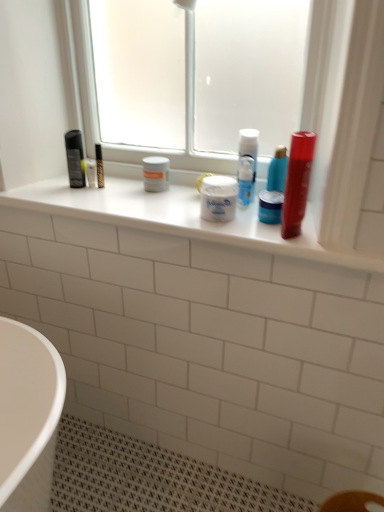
Where is `white matte jar at center`? The width and height of the screenshot is (384, 512). white matte jar at center is located at coordinates (218, 198).

Find the location of a particular element. blue glossy jar at center, which ranks as the second mouthwash in front-to-back order is located at coordinates (270, 206).

What is the approximate width of blue glossy jar at center, the first mouthwash viewed from the back?

3.01 inches.

This screenshot has height=512, width=384. Identify the location of shiny red tube at upper right, arranged as the second mouthwash when viewed from the back. (297, 182).

This screenshot has width=384, height=512. Describe the element at coordinates (297, 182) in the screenshot. I see `shiny red tube at upper right, arranged as the second mouthwash when viewed from the back` at that location.

Image resolution: width=384 pixels, height=512 pixels. What are the coordinates of `white plastic container at center` in the screenshot? It's located at (178, 218).

I want to click on white matte jar at center, so click(218, 198).

Where is `toiletry that appears on the right of white plastic container at center`? Image resolution: width=384 pixels, height=512 pixels. toiletry that appears on the right of white plastic container at center is located at coordinates (218, 198).

What's the angular difference between white matte jar at center and white plastic container at center's facing directions?

0.291 degrees separate the facing orientations of white matte jar at center and white plastic container at center.

From a real-world perspective, is white matte jar at center physically above white plastic container at center?

Correct, in the physical world, white matte jar at center is higher than white plastic container at center.

Is point (221, 180) positioned in front of point (180, 204)?

Yes, point (221, 180) is in front of point (180, 204).

Could white plastic container at center be considered to be inside transparent frosted glass at upper center?

No, white plastic container at center is not a part of transparent frosted glass at upper center.

From a real-world perspective, who is located lower, transparent frosted glass at upper center or white plastic container at center?

From a 3D spatial view, white plastic container at center is below.

Image resolution: width=384 pixels, height=512 pixels. I want to click on window sill lying in front of the transparent frosted glass at upper center, so click(x=178, y=218).

Is transparent frosted glass at upper center facing away from white plastic container at center?

No, white plastic container at center is not at the back of transparent frosted glass at upper center.

From the image's perspective, is blue glossy jar at center, the first mouthwash viewed from the back, located above transparent frosted glass at upper center?

No.

Considering the relative positions of blue glossy jar at center, the first mouthwash viewed from the back, and transparent frosted glass at upper center in the image provided, is blue glossy jar at center, the first mouthwash viewed from the back, to the left or to the right of transparent frosted glass at upper center?

Clearly, blue glossy jar at center, the first mouthwash viewed from the back, is on the right of transparent frosted glass at upper center in the image.

Between blue glossy jar at center, the first mouthwash viewed from the back, and transparent frosted glass at upper center, which one has less height?

Standing shorter between the two is blue glossy jar at center, the first mouthwash viewed from the back.

Is blue glossy jar at center, the first mouthwash viewed from the back, oriented away from transparent frosted glass at upper center?

Yes, blue glossy jar at center, the first mouthwash viewed from the back,'s orientation is away from transparent frosted glass at upper center.

Between blue glossy jar at center, which ranks as the second mouthwash in front-to-back order, and white matte jar at center, which one has larger size?

white matte jar at center.

Which is correct: blue glossy jar at center, the first mouthwash viewed from the back, is inside white matte jar at center, or outside of it?

blue glossy jar at center, the first mouthwash viewed from the back, is spatially situated outside white matte jar at center.

Does point (282, 202) appear closer or farther from the camera than point (232, 218)?

Point (282, 202) is positioned closer to the camera compared to point (232, 218).

Is blue glossy jar at center, which ranks as the second mouthwash in front-to-back order, shorter than white matte jar at center?

Yes, blue glossy jar at center, which ranks as the second mouthwash in front-to-back order, is shorter than white matte jar at center.

Which object is thinner, white matte jar at center or blue glossy jar at center, the first mouthwash viewed from the back?

Thinner between the two is blue glossy jar at center, the first mouthwash viewed from the back.

Is white matte jar at center aimed at blue glossy jar at center, which ranks as the second mouthwash in front-to-back order?

No, white matte jar at center is not turned towards blue glossy jar at center, which ranks as the second mouthwash in front-to-back order.

From the image's perspective, would you say white matte jar at center is shown under blue glossy jar at center, the first mouthwash viewed from the back?

Actually, white matte jar at center appears above blue glossy jar at center, the first mouthwash viewed from the back, in the image.

Where is `toiletry positioned vertically above the blue glossy jar at center, the first mouthwash viewed from the back (from a real-world perspective)`? The image size is (384, 512). toiletry positioned vertically above the blue glossy jar at center, the first mouthwash viewed from the back (from a real-world perspective) is located at coordinates [x=218, y=198].

The width and height of the screenshot is (384, 512). Identify the location of window lying in front of the white matte jar at center. (197, 77).

Does white matte jar at center appear on the left side of transparent frosted glass at upper center?

In fact, white matte jar at center is to the right of transparent frosted glass at upper center.

Is point (216, 209) closer or farther from the camera than point (271, 142)?

Point (216, 209) is closer to the camera than point (271, 142).

Does white plastic container at center have a greater height compared to white matte jar at center?

No, white plastic container at center is not taller than white matte jar at center.

Can you confirm if white plastic container at center is wider than white matte jar at center?

Yes, white plastic container at center is wider than white matte jar at center.

Which point is more forward, [312,231] or [215,203]?

The point [312,231] is closer to the camera.

Identify the location of window sill in front of the white matte jar at center. (178, 218).

In order to click on window sill located underneath the transparent frosted glass at upper center (from a real-world perspective) in this screenshot , I will do `click(178, 218)`.

When comparing their distances from shiny red tube at upper right, arranged as the second mouthwash when viewed from the back, does white matte jar at center or blue glossy jar at center, the first mouthwash viewed from the back, seem further?

white matte jar at center lies further to shiny red tube at upper right, arranged as the second mouthwash when viewed from the back, than the other object.

Considering their positions, is shiny red tube at upper right, which is the first mouthwash in front-to-back order, positioned closer to transparent frosted glass at upper center than white matte jar at center?

white matte jar at center lies closer to transparent frosted glass at upper center than the other object.

From the image, which object appears to be farther from transparent frosted glass at upper center, white matte jar at center or shiny red tube at upper right, which is the first mouthwash in front-to-back order?

shiny red tube at upper right, which is the first mouthwash in front-to-back order, lies further to transparent frosted glass at upper center than the other object.

When comparing their distances from white matte jar at center, does blue glossy jar at center, which ranks as the second mouthwash in front-to-back order, or transparent frosted glass at upper center seem closer?

blue glossy jar at center, which ranks as the second mouthwash in front-to-back order, lies closer to white matte jar at center than the other object.

When comparing their distances from shiny red tube at upper right, arranged as the second mouthwash when viewed from the back, does blue glossy jar at center, the first mouthwash viewed from the back, or transparent frosted glass at upper center seem further?

transparent frosted glass at upper center is positioned further to the anchor shiny red tube at upper right, arranged as the second mouthwash when viewed from the back.

From the image, which object appears to be nearer to white plastic container at center, transparent frosted glass at upper center or white matte jar at center?

white matte jar at center.

Based on their spatial positions, is transparent frosted glass at upper center or white matte jar at center closer to blue glossy jar at center, the first mouthwash viewed from the back?

white matte jar at center is positioned closer to the anchor blue glossy jar at center, the first mouthwash viewed from the back.

Looking at the image, which one is located closer to shiny red tube at upper right, which is the first mouthwash in front-to-back order, blue glossy jar at center, which ranks as the second mouthwash in front-to-back order, or white matte jar at center?

blue glossy jar at center, which ranks as the second mouthwash in front-to-back order.

The height and width of the screenshot is (512, 384). Identify the location of mouthwash located between white plastic container at center and shiny red tube at upper right, which is the first mouthwash in front-to-back order, in the left-right direction. (270, 206).

Find the location of `window sill between transparent frosted glass at upper center and shiny red tube at upper right, which is the first mouthwash in front-to-back order, in the vertical direction`. window sill between transparent frosted glass at upper center and shiny red tube at upper right, which is the first mouthwash in front-to-back order, in the vertical direction is located at coordinates (178, 218).

This screenshot has width=384, height=512. Identify the location of mouthwash between transparent frosted glass at upper center and blue glossy jar at center, the first mouthwash viewed from the back, from top to bottom. (297, 182).

At what (x,y) coordinates should I click in order to perform the action: click on toiletry located between white plastic container at center and blue glossy jar at center, which ranks as the second mouthwash in front-to-back order, in the left-right direction. Please return your answer as a coordinate pair (x, y). The height and width of the screenshot is (512, 384). Looking at the image, I should click on (218, 198).